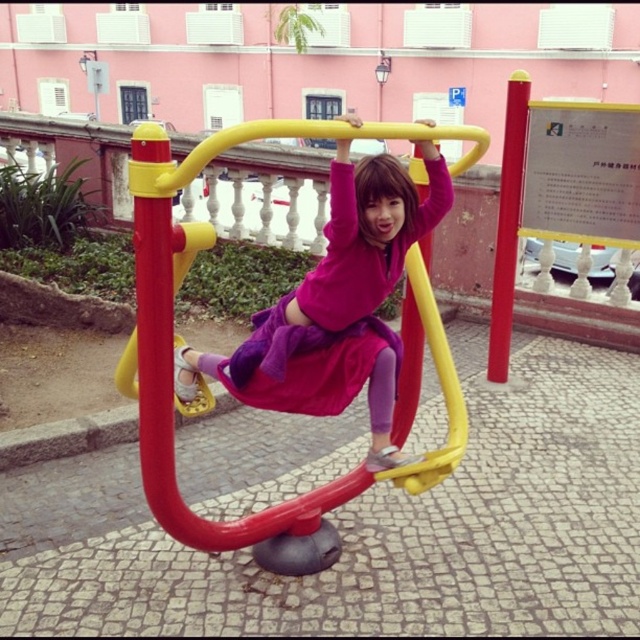
Is point (353, 484) farther from camera compared to point (372, 326)?

Yes.

Between matte plastic swing at center and purple velvet dress at center, which one is positioned lower?

matte plastic swing at center

Locate an element on the screen. The image size is (640, 640). matte plastic swing at center is located at coordinates (172, 316).

Identify the location of matte plastic swing at center. Image resolution: width=640 pixels, height=640 pixels. (172, 316).

Does purple velvet dress at center have a larger size compared to red plastic pole at center?

Correct, purple velvet dress at center is larger in size than red plastic pole at center.

Who is higher up, purple velvet dress at center or red plastic pole at center?

red plastic pole at center

Where is `purple velvet dress at center`? purple velvet dress at center is located at coordinates (332, 310).

Between point (145, 403) and point (502, 188), which one is positioned behind?

The point (502, 188) is behind.

Measure the distance between matte plastic swing at center and red plastic pole at center.

A distance of 7.26 feet exists between matte plastic swing at center and red plastic pole at center.

Describe the element at coordinates (172, 316) in the screenshot. I see `matte plastic swing at center` at that location.

Find the location of a particular element. matte plastic swing at center is located at coordinates (172, 316).